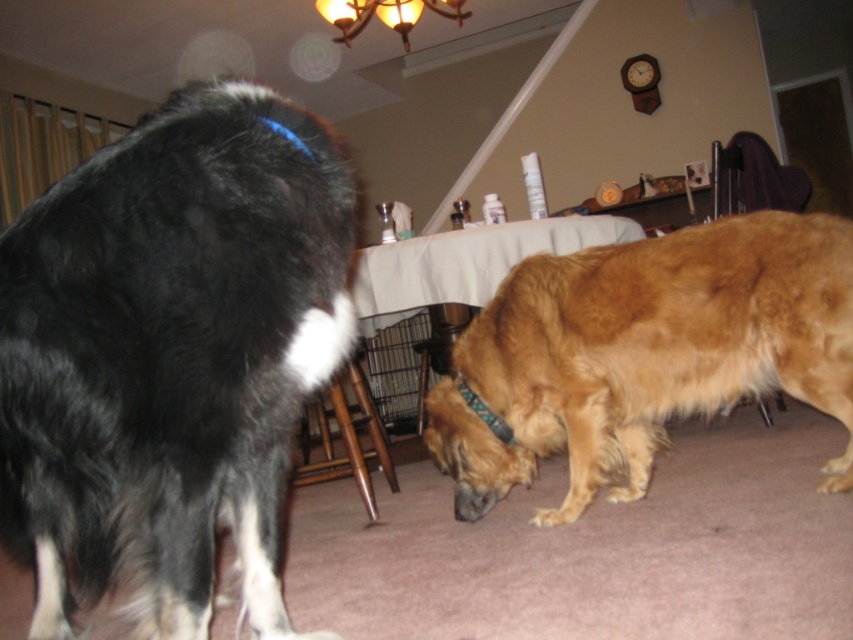
Consider the image. You are a visitor entering the dining room and see the black fluffy dog at left and the golden fur dog at lower right. Which dog is positioned more to the left side of the room?

The black fluffy dog at left is positioned more to the left side of the room compared to the golden fur dog at lower right.

You are a robotic vacuum cleaner in the dining area. You need to move from the spray bottle to the dog with the blue collar. The spray bottle is located at point (207, 112), and the dog with the blue collar is at point (518, 368). Is the path from the spray bottle to the dog with the blue collar clear of obstacles?

The path from point (207, 112) to point (518, 368) is clear because point (207, 112) is in front of point (518, 368), meaning there are no objects blocking the way between them.

You are a dog owner who wants to place a dog bed in the dining area. You have two dogs, the black fluffy dog at left and the golden fur dog at lower right. Which dog might need a taller bed due to its height?

The black fluffy dog at left has a greater height compared to the golden fur dog at lower right, so it might need a taller bed.